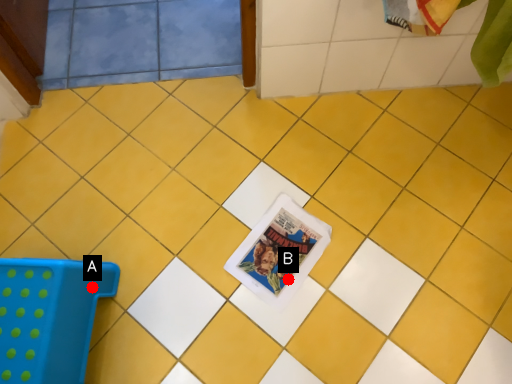
Question: Two points are circled on the image, labeled by A and B beside each circle. Which of the following is the farthest from the observer?

Choices:
 (A) A is further
 (B) B is further

Answer: (B)